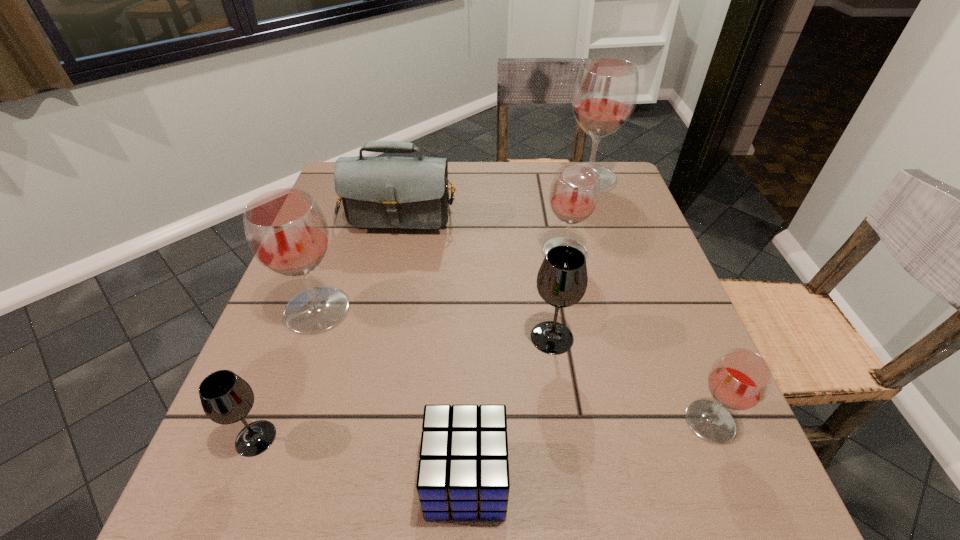
Identify the location of free space located on the back of the nearest red wineglass. (682, 352).

Identify the location of free space located 0.200m on the right of the cube. The image size is (960, 540). (639, 480).

You are a GUI agent. You are given a task and a screenshot of the screen. Output one action in this format:
    pyautogui.click(x=<x>, y=<y>)
    Task: Click on the wineglass located at the far edge
    This screenshot has width=960, height=540.
    Given the screenshot: What is the action you would take?
    pyautogui.click(x=605, y=92)

Where is `shoulder bag at the far edge`? The height and width of the screenshot is (540, 960). shoulder bag at the far edge is located at coordinates [x=377, y=192].

I want to click on object positioned at the near edge, so click(463, 472).

Locate an element on the screen. shoulder bag present at the left edge is located at coordinates (377, 192).

Where is `object present at the far left corner`? This screenshot has width=960, height=540. object present at the far left corner is located at coordinates (377, 192).

Locate an element on the screen. object located at the far right corner is located at coordinates (605, 92).

Locate an element on the screen. The width and height of the screenshot is (960, 540). vacant space at the far edge is located at coordinates (535, 188).

The image size is (960, 540). What are the coordinates of `vacant region at the near edge of the desktop` in the screenshot? It's located at (472, 525).